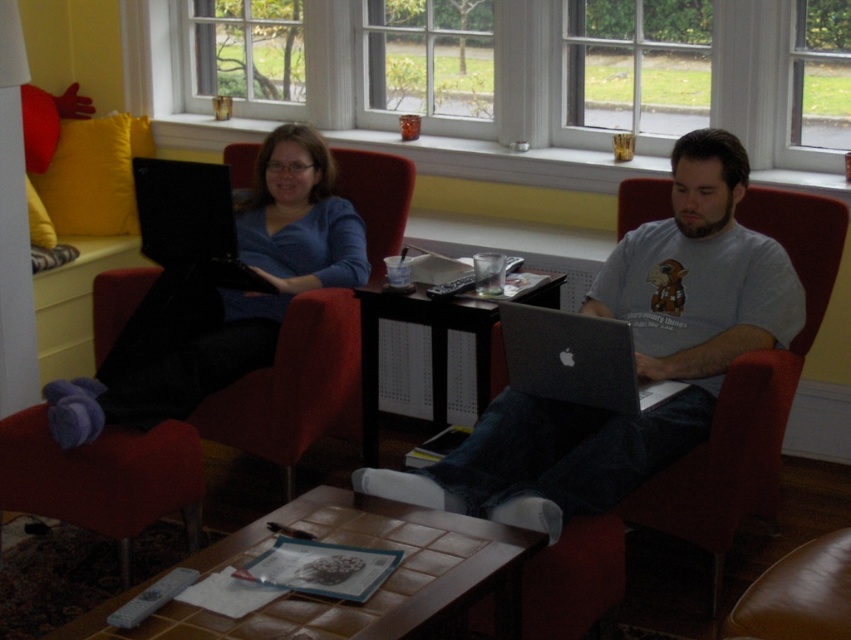
Question: Which of the following is the closest to the observer?

Choices:
 (A) matte gray laptop at center
 (B) silver metallic laptop at center

Answer: (A)

Question: Does matte gray laptop at center have a lesser width compared to brown tile table at center?

Choices:
 (A) no
 (B) yes

Answer: (A)

Question: Which of these objects is positioned closest to the wooden table at center?

Choices:
 (A) red fabric chair at center
 (B) matte gray laptop at center
 (C) black matte laptop at center

Answer: (B)

Question: Which object appears farthest from the camera in this image?

Choices:
 (A) wooden table at center
 (B) brown tile table at center
 (C) black matte laptop at center
 (D) silver metallic laptop at center

Answer: (C)

Question: From the image, what is the correct spatial relationship of silver metallic laptop at center in relation to wooden table at center?

Choices:
 (A) above
 (B) below

Answer: (A)

Question: In this image, where is brown tile table at center located relative to black fabric armchair at left?

Choices:
 (A) below
 (B) above

Answer: (A)